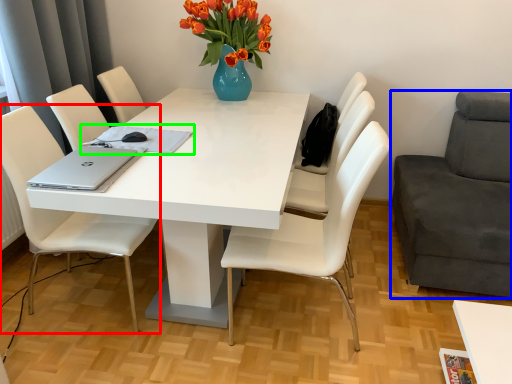
Question: Which object is the farthest from chair (highlighted by a red box)? Choose among these: chair (highlighted by a blue box) or notepad (highlighted by a green box).

Choices:
 (A) chair
 (B) notepad

Answer: (A)